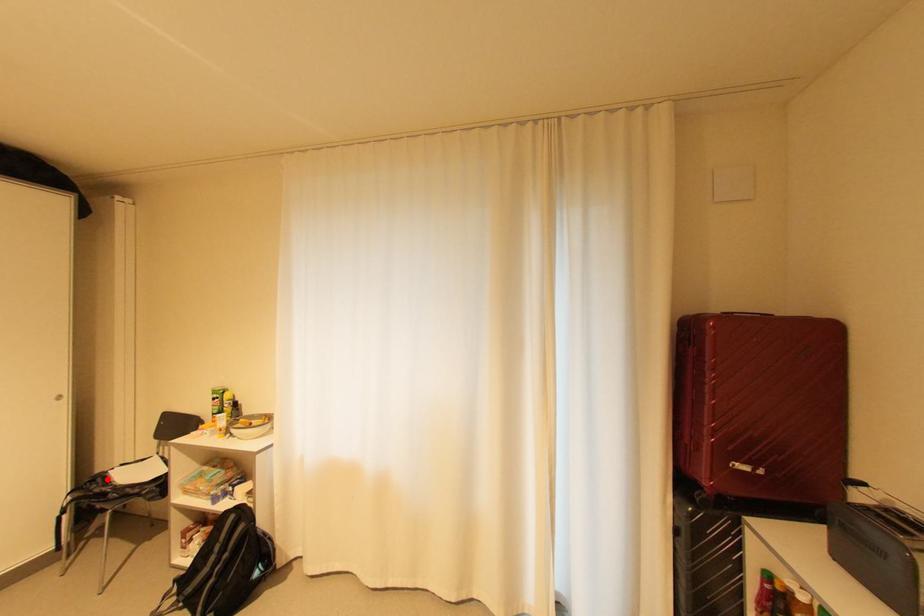
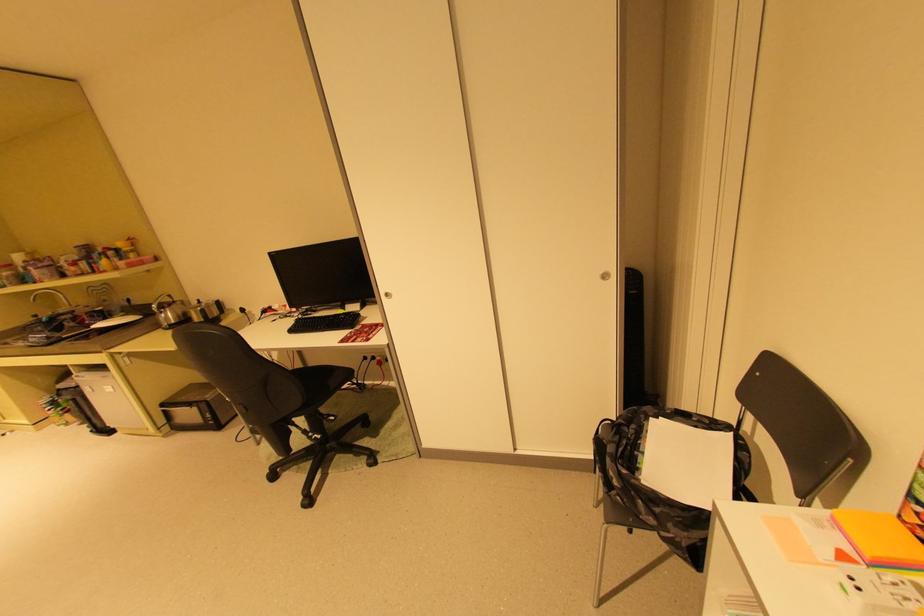
Question: A red point is marked in image1. In image2, is the corresponding 3D point closer to the camera or farther? Reply with the corresponding letter.

Choices:
 (A) The corresponding 3D point is closer.
 (B) The corresponding 3D point is farther.

Answer: (B)